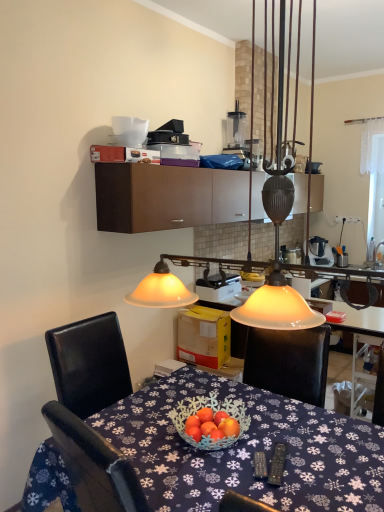
The width and height of the screenshot is (384, 512). Identify the location of free point above blue fabric tablecloth at center (from a real-world perspective). (226, 439).